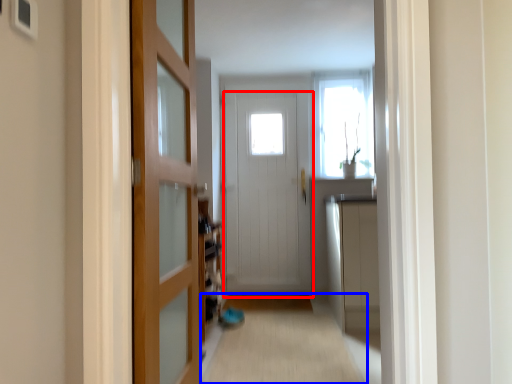
Question: Which object appears farthest to the camera in this image, door (highlighted by a red box) or alley (highlighted by a blue box)?

Choices:
 (A) door
 (B) alley

Answer: (A)